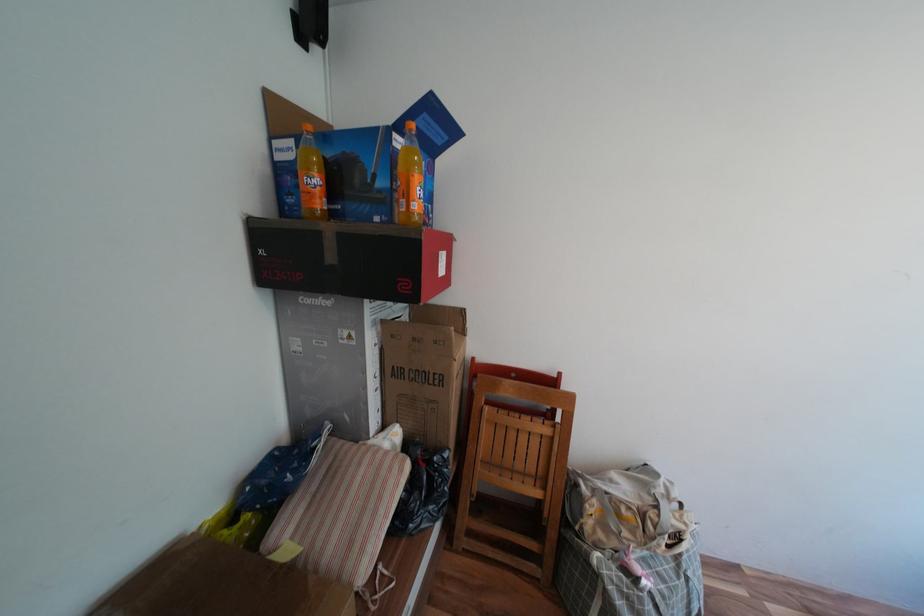
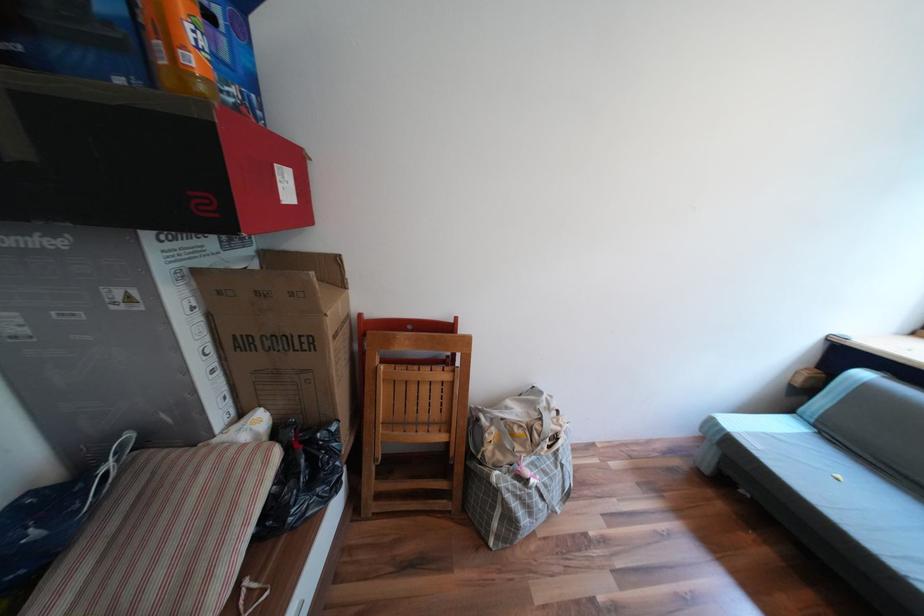
Question: The images are taken continuously from a first-person perspective. In which direction is your viewpoint rotating?

Choices:
 (A) Left
 (B) Right
 (C) Up
 (D) Down

Answer: (B)